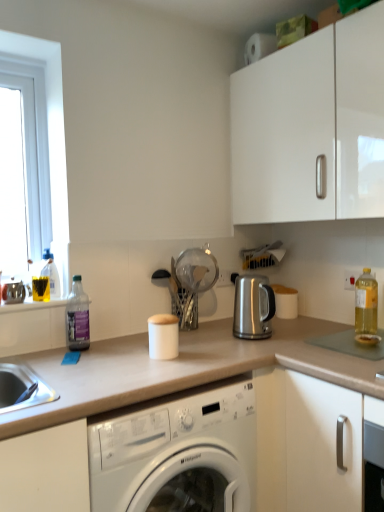
Identify the location of vacant space in front of clear plastic bottle at left, which ranks as the 2th bottle in left-to-right order. (72, 364).